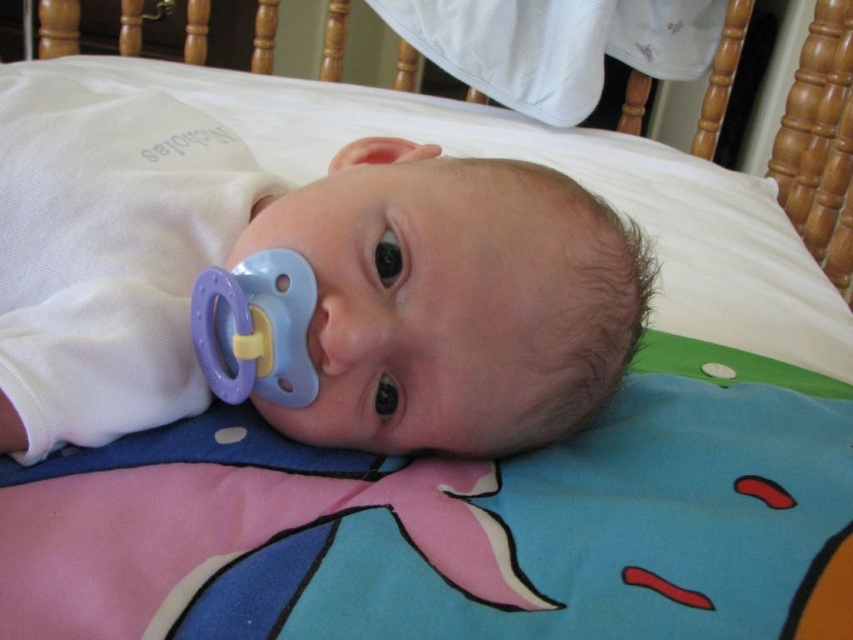
You are a nurse checking the baby in the bed. You need to place a small medical tool that is 10 cm long between the white soft baby at center and the purple plastic pacifier at center. Can you fit it there?

The white soft baby at center might be wider than the purple plastic pacifier at center, so the space between them may be sufficient to fit the 10 cm medical tool. However, without exact measurements, it is uncertain. Please verify the available space before placing the tool.

You are a pediatrician examining a baby in the image. The baby is lying on its back on a bed with a colorful blanket. You need to check if the pacifier is within a safe distance from the baby to prevent choking. The recommended safe distance is 12 inches. Is the purple plastic pacifier at center within the safe distance of the white soft baby at center?

The distance between the white soft baby at center and the purple plastic pacifier at center is 3.97 inches, which is less than the recommended 12 inches. Therefore, the pacifier is too close and poses a choking hazard. It should be moved further away to ensure safety.

You are a photographer taking a picture of the baby. You notice two points in the image at coordinates point (53, 200) and point (283, 364). Which point should you focus on to ensure the baby is in focus?

You should focus on point (283, 364) because it is in front of point (53, 200), making it closer to the camera and thus better for focusing on the baby.